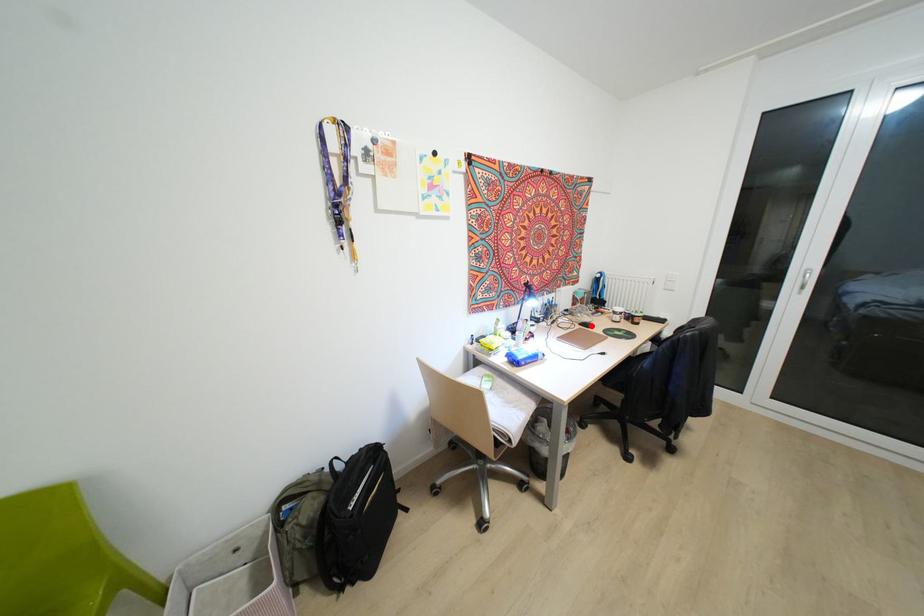
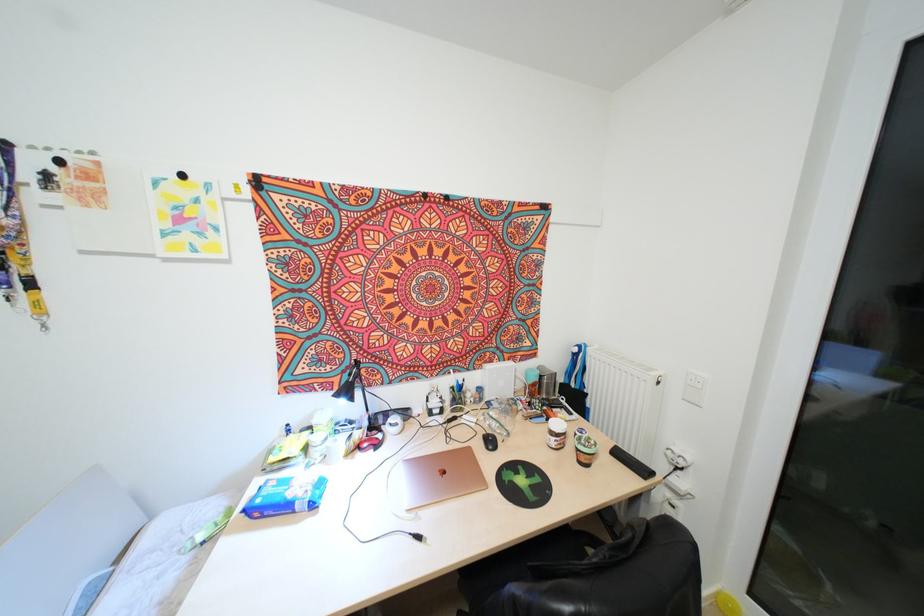
Locate, in the second image, the point that corresponds to the highlighted location in the first image.

(494, 448)